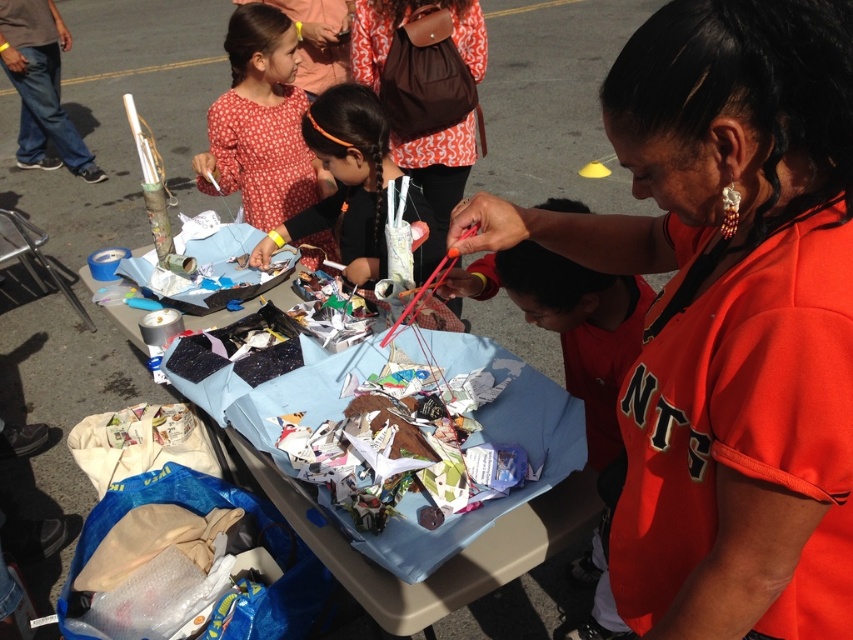
You are a photographer trying to capture the blue fabric table at center and the red dotted blouse at upper left in a single shot. Based on their positions, which object should you focus on first to ensure both are in frame?

The blue fabric table at center is below the red dotted blouse at upper left, so you should focus on the red dotted blouse at upper left first to ensure both are in frame.

You are standing at the edge of the scene and want to reach the blue fabric table at center without stepping on the jeans at left. Is there a way to do this?

The blue fabric table at center is positioned under jeans at left, so you can reach the blue fabric table at center by moving around the jeans at left since they are above it in the scene.

You are organizing a craft event and need to place a sign on the table. The sign requires a space wider than the orange jersey at center. Can the jeans at left provide enough width for the sign?

A: The orange jersey at center is narrower than the jeans at left. Since the sign requires a space wider than the orange jersey at center, the jeans at left can provide sufficient width for the sign.